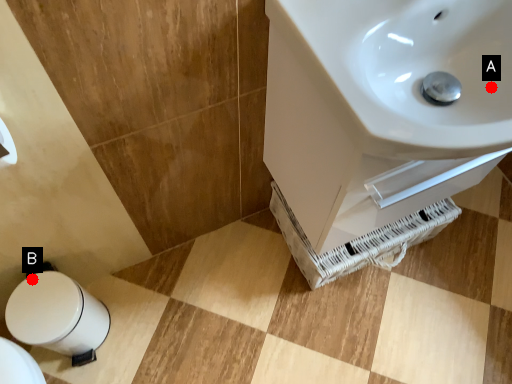
Question: Two points are circled on the image, labeled by A and B beside each circle. Which point is closer to the camera taking this photo?

Choices:
 (A) A is closer
 (B) B is closer

Answer: (A)